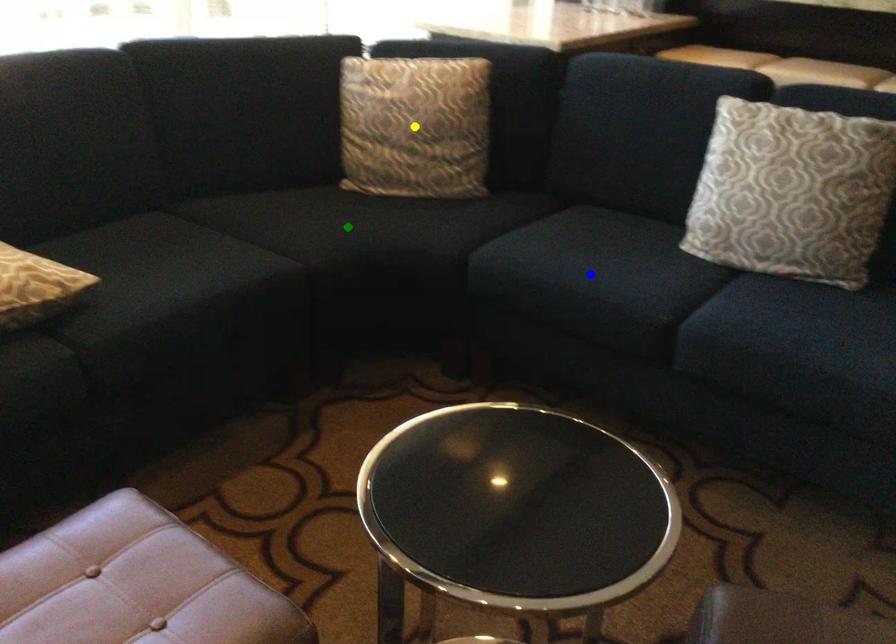
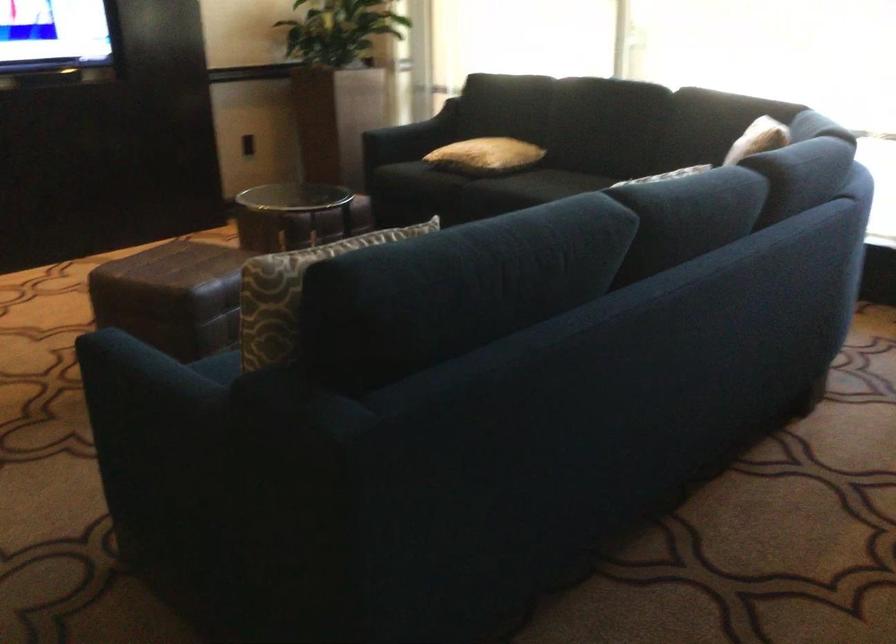
I am providing you with two images of the same scene from different viewpoints. Three points are marked in image1. Which point corresponds to a part or object that is occluded in image2?In image1, three points are marked. Which of them correspond to a part or object that is occluded in image2?Among the three points shown in image1, which one corresponds to a part or object that is no longer visible due to occlusion in image2?

yellow point, blue point, green point